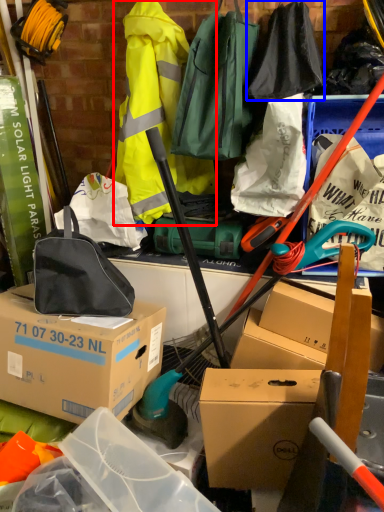
Question: Which object is further to the camera taking this photo, clothing (highlighted by a red box) or clothing (highlighted by a blue box)?

Choices:
 (A) clothing
 (B) clothing

Answer: (A)